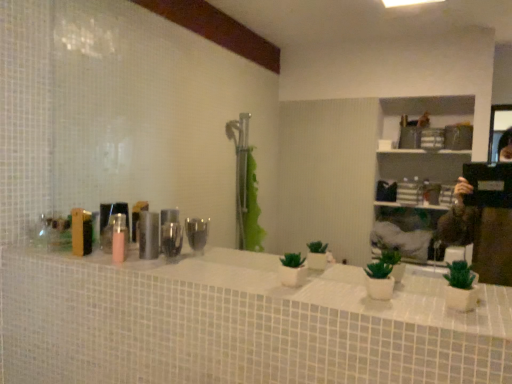
What is the approximate height of white glossy counter top at center?

The height of white glossy counter top at center is 0.74 inches.

At what (x,y) coordinates should I click in order to perform the action: click on wooden box at left, arranged as the second toiletry when viewed from the right. Please return your answer as a coordinate pair (x, y). Looking at the image, I should click on (81, 232).

You are a GUI agent. You are given a task and a screenshot of the screen. Output one action in this format:
    pyautogui.click(x=<x>, y=<y>)
    Task: Click on the white glossy counter top at center
    The image size is (512, 384).
    Given the screenshot: What is the action you would take?
    pyautogui.click(x=312, y=286)

Between metallic cylindrical container at center, the 2th toiletry positioned from the left, and wooden box at left, the first toiletry when ordered from left to right, which one is positioned in front?

Positioned in front is metallic cylindrical container at center, the 2th toiletry positioned from the left.

What's the angular difference between metallic cylindrical container at center, the 2th toiletry positioned from the left, and wooden box at left, arranged as the second toiletry when viewed from the right,'s facing directions?

They differ by 0.000686 degrees in their facing directions.

Is metallic cylindrical container at center, the 2th toiletry positioned from the left, far away from wooden box at left, arranged as the second toiletry when viewed from the right?

Actually, metallic cylindrical container at center, the 2th toiletry positioned from the left, and wooden box at left, arranged as the second toiletry when viewed from the right, are a little close together.

Between metallic cylindrical container at center, which is the first toiletry in right-to-left order, and wooden box at left, arranged as the second toiletry when viewed from the right, which one has smaller size?

metallic cylindrical container at center, which is the first toiletry in right-to-left order, is smaller.

How far apart are wooden box at left, the first toiletry when ordered from left to right, and white glossy counter top at center?

wooden box at left, the first toiletry when ordered from left to right, and white glossy counter top at center are 47.85 centimeters apart.

The width and height of the screenshot is (512, 384). In order to click on counter top below the wooden box at left, arranged as the second toiletry when viewed from the right (from the image's perspective) in this screenshot , I will do `click(312, 286)`.

Considering the relative positions of wooden box at left, arranged as the second toiletry when viewed from the right, and white glossy counter top at center in the image provided, is wooden box at left, arranged as the second toiletry when viewed from the right, to the left of white glossy counter top at center from the viewer's perspective?

Yes, wooden box at left, arranged as the second toiletry when viewed from the right, is to the left of white glossy counter top at center.

Between wooden box at left, the first toiletry when ordered from left to right, and white glossy counter top at center, which one has more height?

wooden box at left, the first toiletry when ordered from left to right.

Considering the positions of objects metallic cylindrical container at center, the 2th toiletry positioned from the left, and white glossy counter top at center in the image provided, who is behind, metallic cylindrical container at center, the 2th toiletry positioned from the left, or white glossy counter top at center?

metallic cylindrical container at center, the 2th toiletry positioned from the left, is further away from the camera.

Between metallic cylindrical container at center, which is the first toiletry in right-to-left order, and white glossy counter top at center, which one has smaller width?

metallic cylindrical container at center, which is the first toiletry in right-to-left order, is thinner.

Does metallic cylindrical container at center, which is the first toiletry in right-to-left order, appear on the right side of white glossy counter top at center?

No, metallic cylindrical container at center, which is the first toiletry in right-to-left order, is not to the right of white glossy counter top at center.

Which of these two, metallic cylindrical container at center, which is the first toiletry in right-to-left order, or white glossy counter top at center, stands shorter?

With less height is white glossy counter top at center.

Considering the positions of objects white glossy counter top at center and wooden box at left, arranged as the second toiletry when viewed from the right, in the image provided, who is in front, white glossy counter top at center or wooden box at left, arranged as the second toiletry when viewed from the right,?

white glossy counter top at center is in front.

Considering the relative positions of white glossy counter top at center and wooden box at left, the first toiletry when ordered from left to right, in the image provided, is white glossy counter top at center to the right of wooden box at left, the first toiletry when ordered from left to right, from the viewer's perspective?

Yes.

Does white glossy counter top at center touch wooden box at left, the first toiletry when ordered from left to right?

No, white glossy counter top at center is not in contact with wooden box at left, the first toiletry when ordered from left to right.

How far apart are white glossy counter top at center and wooden box at left, arranged as the second toiletry when viewed from the right?

white glossy counter top at center and wooden box at left, arranged as the second toiletry when viewed from the right, are 18.84 inches apart from each other.

Is white glossy counter top at center far away from metallic cylindrical container at center, which is the first toiletry in right-to-left order?

white glossy counter top at center is actually quite close to metallic cylindrical container at center, which is the first toiletry in right-to-left order.

Which object is positioned more to the right, white glossy counter top at center or metallic cylindrical container at center, the 2th toiletry positioned from the left?

white glossy counter top at center.

Is the position of white glossy counter top at center more distant than that of metallic cylindrical container at center, which is the first toiletry in right-to-left order?

No, it is not.

Considering the points (215, 262) and (139, 222), which point is in front, point (215, 262) or point (139, 222)?

The point (215, 262) is in front.

From the image's perspective, relative to metallic cylindrical container at center, the 2th toiletry positioned from the left, is wooden box at left, the first toiletry when ordered from left to right, above or below?

Clearly, from the image's perspective, wooden box at left, the first toiletry when ordered from left to right, is above metallic cylindrical container at center, the 2th toiletry positioned from the left.

Can you confirm if wooden box at left, the first toiletry when ordered from left to right, is bigger than metallic cylindrical container at center, which is the first toiletry in right-to-left order?

Yes, wooden box at left, the first toiletry when ordered from left to right, is bigger than metallic cylindrical container at center, which is the first toiletry in right-to-left order.

Is wooden box at left, arranged as the second toiletry when viewed from the right, oriented towards metallic cylindrical container at center, the 2th toiletry positioned from the left?

No, wooden box at left, arranged as the second toiletry when viewed from the right, is not facing towards metallic cylindrical container at center, the 2th toiletry positioned from the left.

Does wooden box at left, arranged as the second toiletry when viewed from the right, appear on the left side of metallic cylindrical container at center, the 2th toiletry positioned from the left?

Indeed, wooden box at left, arranged as the second toiletry when viewed from the right, is positioned on the left side of metallic cylindrical container at center, the 2th toiletry positioned from the left.

Where is `toiletry above the metallic cylindrical container at center, which is the first toiletry in right-to-left order (from the image's perspective)`? This screenshot has width=512, height=384. toiletry above the metallic cylindrical container at center, which is the first toiletry in right-to-left order (from the image's perspective) is located at coordinates (81, 232).

At what (x,y) coordinates should I click in order to perform the action: click on counter top lying in front of the wooden box at left, arranged as the second toiletry when viewed from the right. Please return your answer as a coordinate pair (x, y). The height and width of the screenshot is (384, 512). Looking at the image, I should click on (312, 286).

Which object lies further to the anchor point wooden box at left, arranged as the second toiletry when viewed from the right, metallic cylindrical container at center, which is the first toiletry in right-to-left order, or white glossy counter top at center?

white glossy counter top at center.

Considering their positions, is white glossy counter top at center positioned closer to metallic cylindrical container at center, the 2th toiletry positioned from the left, than wooden box at left, arranged as the second toiletry when viewed from the right?

wooden box at left, arranged as the second toiletry when viewed from the right, is positioned closer to the anchor metallic cylindrical container at center, the 2th toiletry positioned from the left.

Considering their positions, is wooden box at left, arranged as the second toiletry when viewed from the right, positioned further to white glossy counter top at center than metallic cylindrical container at center, the 2th toiletry positioned from the left?

wooden box at left, arranged as the second toiletry when viewed from the right, is positioned further to the anchor white glossy counter top at center.

From the image, which object appears to be farther from white glossy counter top at center, metallic cylindrical container at center, which is the first toiletry in right-to-left order, or wooden box at left, arranged as the second toiletry when viewed from the right?

Among the two, wooden box at left, arranged as the second toiletry when viewed from the right, is located further to white glossy counter top at center.

Looking at the image, which one is located further to metallic cylindrical container at center, which is the first toiletry in right-to-left order, wooden box at left, arranged as the second toiletry when viewed from the right, or white glossy counter top at center?

white glossy counter top at center.

Estimate the real-world distances between objects in this image. Which object is further from wooden box at left, the first toiletry when ordered from left to right, white glossy counter top at center or metallic cylindrical container at center, which is the first toiletry in right-to-left order?

white glossy counter top at center lies further to wooden box at left, the first toiletry when ordered from left to right, than the other object.

I want to click on toiletry between white glossy counter top at center and wooden box at left, the first toiletry when ordered from left to right, along the z-axis, so pos(148,235).